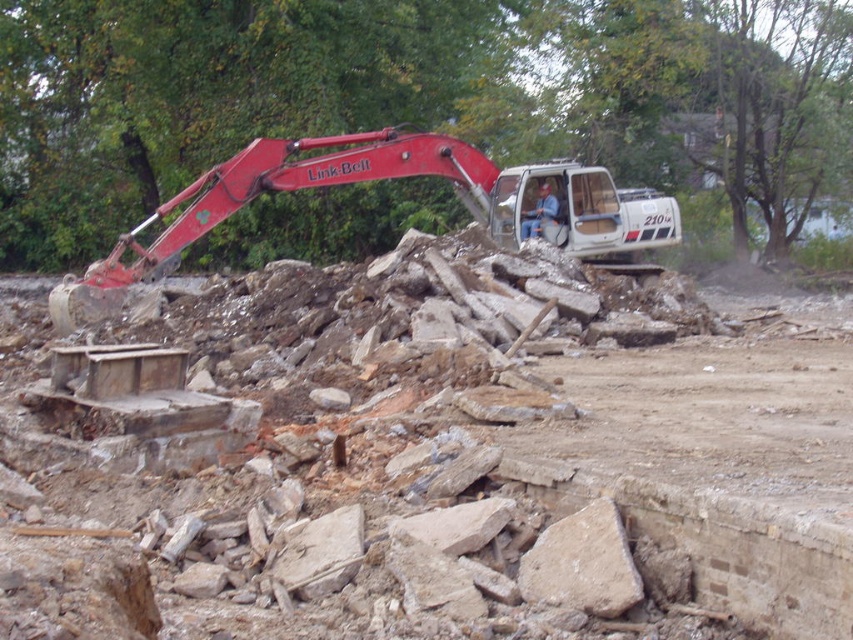
Between matte red excavator at upper left and blue denim shirt at center, which one is positioned higher?

Positioned higher is matte red excavator at upper left.

Is point (395, 131) positioned behind point (521, 220)?

No, it is not.

Who is more forward, (172,198) or (552,196)?

Point (552,196)

Where is `matte red excavator at upper left`? The height and width of the screenshot is (640, 853). matte red excavator at upper left is located at coordinates (374, 179).

Between rusty metal debris at center and blue denim shirt at center, which one appears on the right side from the viewer's perspective?

blue denim shirt at center

Is rusty metal debris at center below blue denim shirt at center?

Yes, rusty metal debris at center is below blue denim shirt at center.

Locate an element on the screen. rusty metal debris at center is located at coordinates (445, 467).

Locate an element on the screen. rusty metal debris at center is located at coordinates (445, 467).

Which is below, rusty metal debris at center or matte red excavator at upper left?

rusty metal debris at center is lower down.

Is point (815, 600) closer to viewer compared to point (67, 317)?

Yes, point (815, 600) is in front of point (67, 317).

Identify the location of rusty metal debris at center. (x=445, y=467).